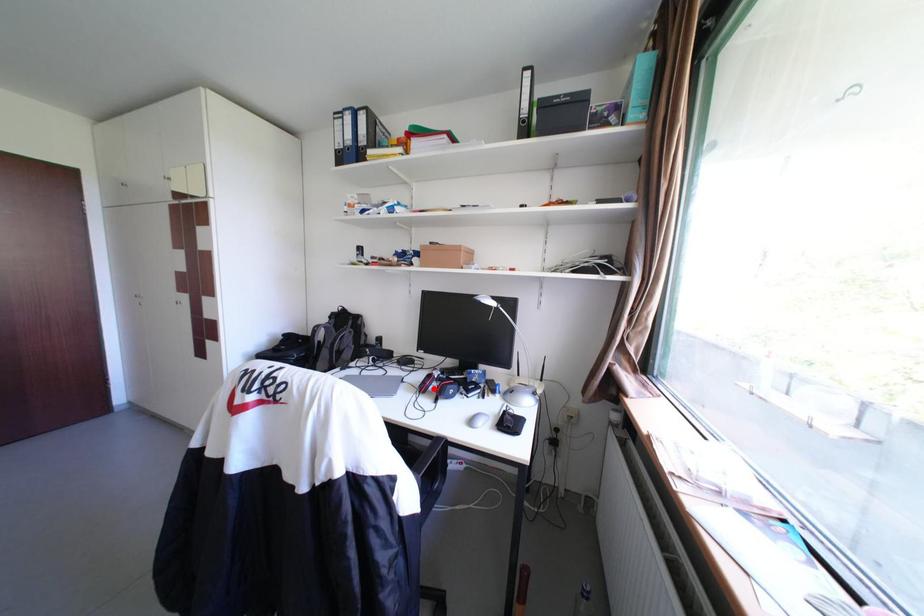
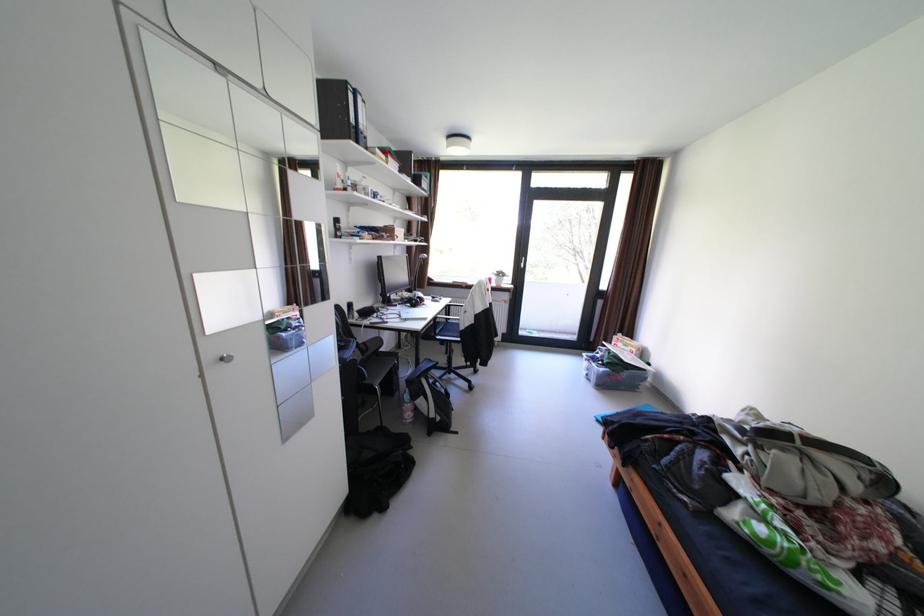
Question: I am providing you with two images of the same scene from different viewpoints. A red point is marked on the first image. Is the red point's position out of view in image 2?

Choices:
 (A) Yes
 (B) No

Answer: (A)